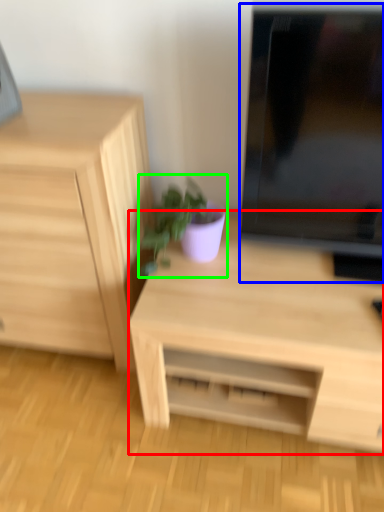
Question: Estimate the real-world distances between objects in this image. Which object is farther from desk (highlighted by a red box), computer monitor (highlighted by a blue box) or houseplant (highlighted by a green box)?

Choices:
 (A) computer monitor
 (B) houseplant

Answer: (A)